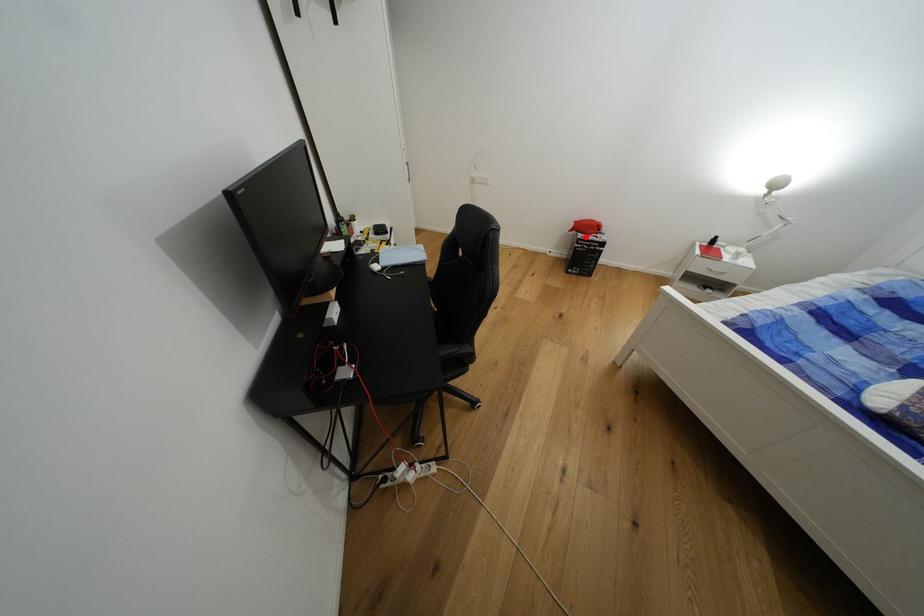
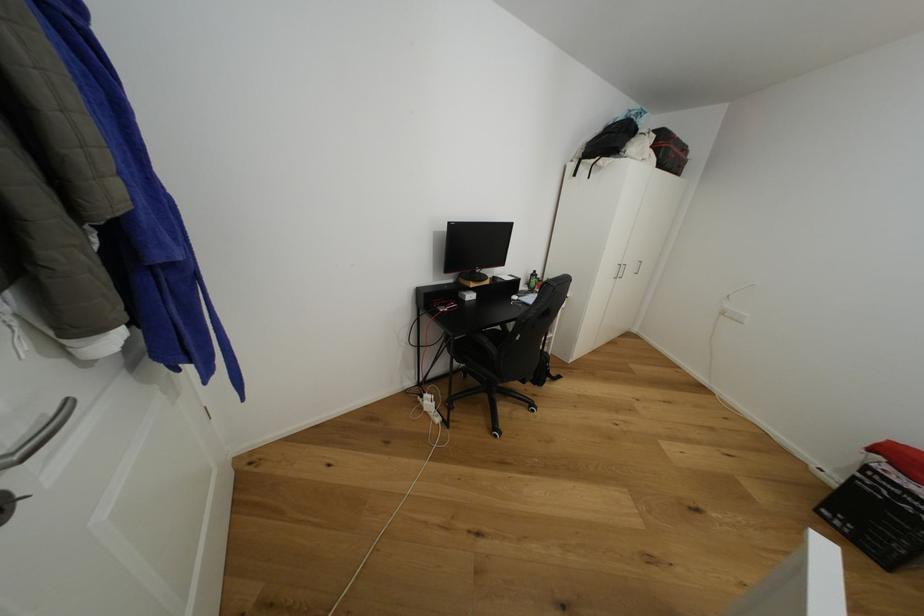
In the second image, find the point that corresponds to the highlighted location in the first image.

(893, 469)